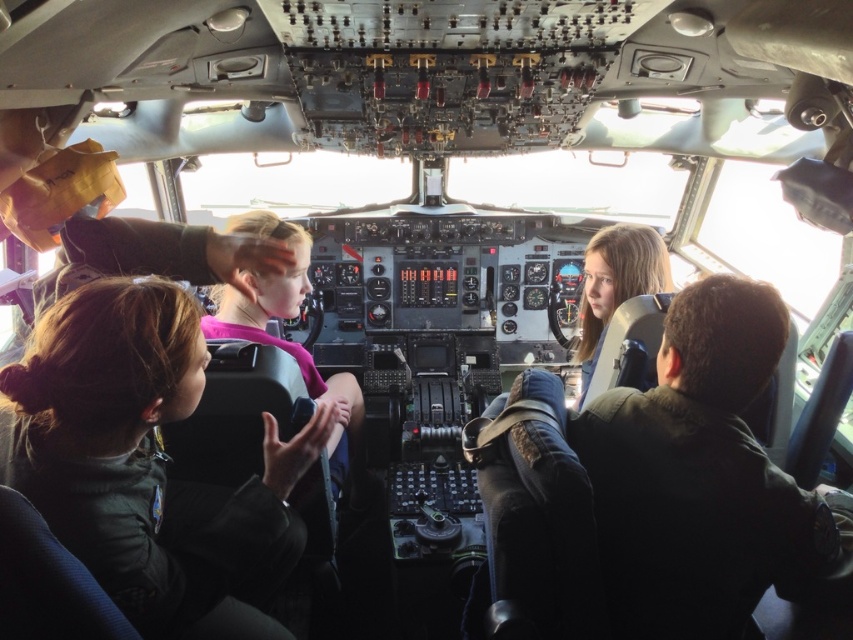
Question: Is dark green uniform at left further to camera compared to pink fabric shirt at center?

Choices:
 (A) no
 (B) yes

Answer: (A)

Question: Estimate the real-world distances between objects in this image. Which object is closer to the dark green uniform at left?

Choices:
 (A) pink fabric shirt at center
 (B) dark brown leather jacket at center

Answer: (A)

Question: Estimate the real-world distances between objects in this image. Which object is closer to the dark green uniform at left?

Choices:
 (A) dark brown leather jacket at center
 (B) pink fabric shirt at center

Answer: (B)

Question: Is dark green uniform at left further to camera compared to dark brown leather jacket at center?

Choices:
 (A) yes
 (B) no

Answer: (B)

Question: Is dark brown leather jacket at center thinner than pink fabric shirt at center?

Choices:
 (A) no
 (B) yes

Answer: (B)

Question: Which of the following is the closest to the observer?

Choices:
 (A) (183, 552)
 (B) (683, 605)
 (C) (254, 328)

Answer: (B)